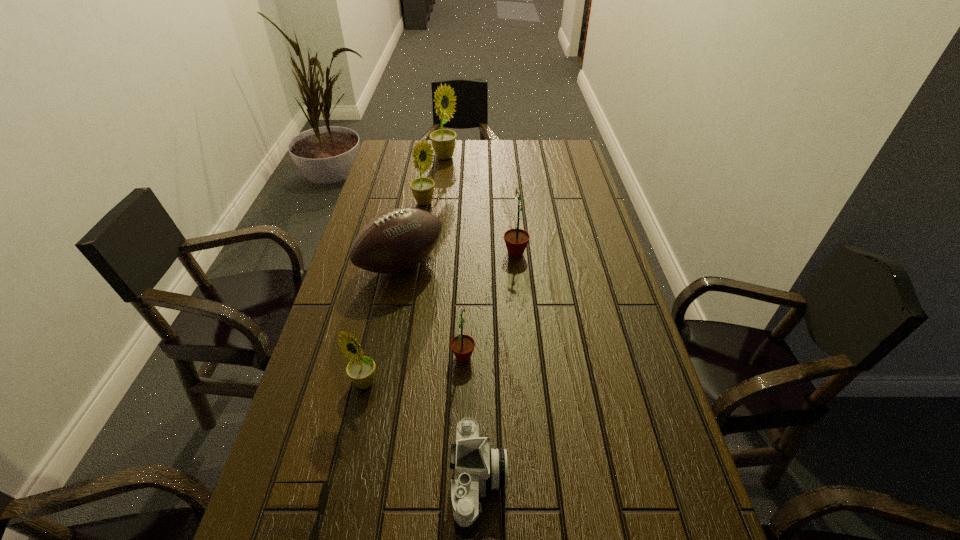
You are a GUI agent. You are given a task and a screenshot of the screen. Output one action in this format:
    pyautogui.click(x=<x>, y=<y>)
    Task: Click on the farthest object
    The image size is (960, 540).
    Given the screenshot: What is the action you would take?
    point(443,141)

This screenshot has height=540, width=960. What are the coordinates of `the tallest sunflower` in the screenshot? It's located at (443, 141).

Locate an element on the screen. This screenshot has height=540, width=960. the second farthest object is located at coordinates (422, 188).

Locate an element on the screen. Image resolution: width=960 pixels, height=540 pixels. the second nearest yellow sunflower is located at coordinates click(x=422, y=188).

You are a GUI agent. You are given a task and a screenshot of the screen. Output one action in this format:
    pyautogui.click(x=<x>, y=<y>)
    Task: Click on the farther green sunflower
    
    Given the screenshot: What is the action you would take?
    pyautogui.click(x=516, y=240)

This screenshot has height=540, width=960. I want to click on the rightmost object, so click(x=516, y=240).

Locate an element on the screen. This screenshot has height=540, width=960. football (American) is located at coordinates (395, 240).

You are a GUI agent. You are given a task and a screenshot of the screen. Output one action in this format:
    pyautogui.click(x=<x>, y=<y>)
    Task: Click on the second sunflower from right to left
    The width and height of the screenshot is (960, 540).
    Given the screenshot: What is the action you would take?
    pyautogui.click(x=462, y=346)

Where is `the nearer green sunflower`? The width and height of the screenshot is (960, 540). the nearer green sunflower is located at coordinates (462, 346).

You are a GUI agent. You are given a task and a screenshot of the screen. Output one action in this format:
    pyautogui.click(x=<x>, y=<y>)
    Task: Click on the nearest yellow sunflower
    The height and width of the screenshot is (540, 960).
    Given the screenshot: What is the action you would take?
    pyautogui.click(x=361, y=369)